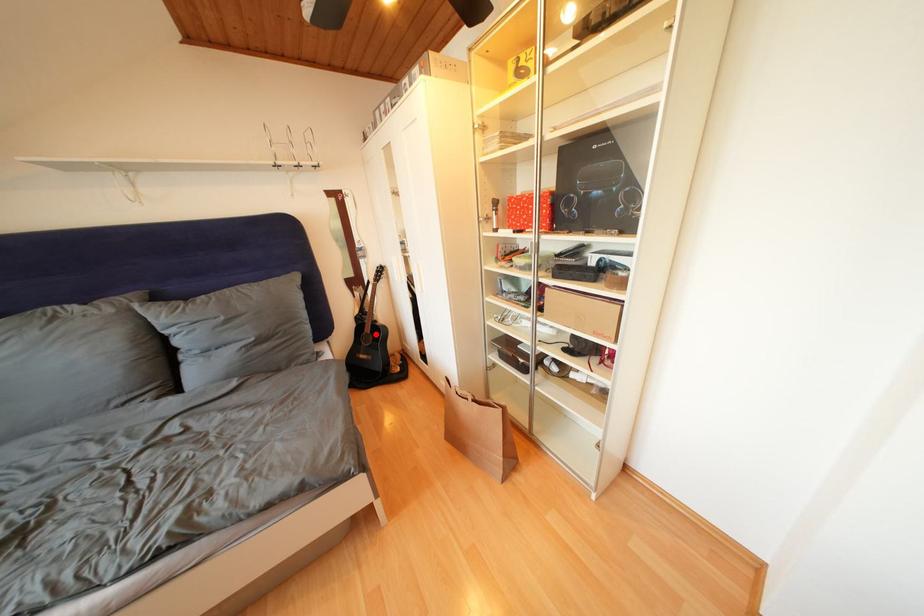
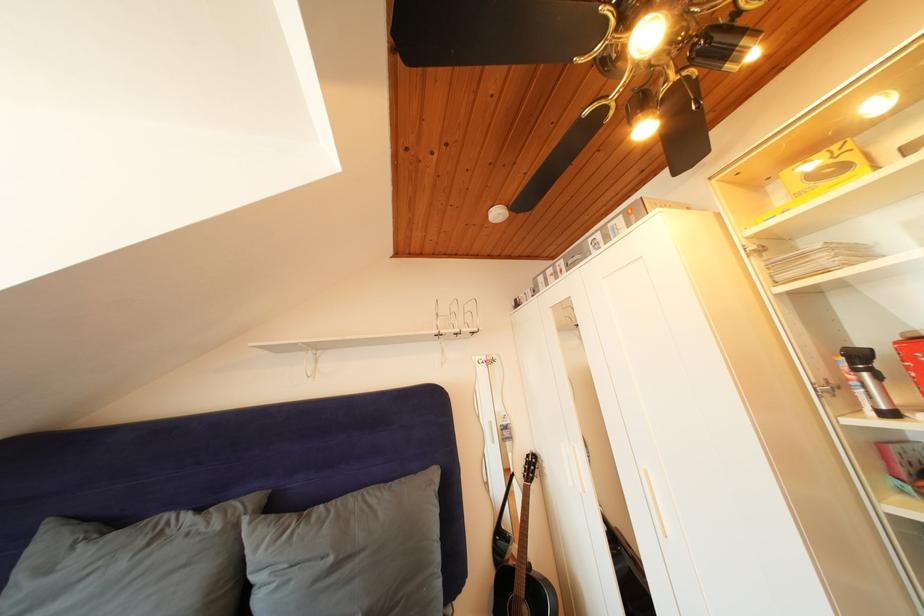
In the second image, find the point that corresponds to the highlighted location in the first image.

(528, 592)